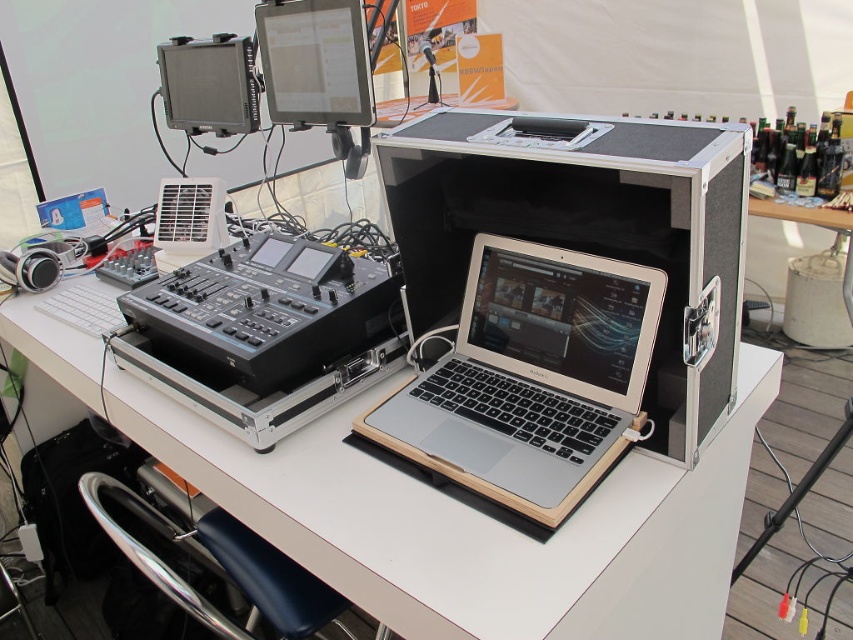
What object is located at the coordinates point (583, 225)?

The point (583, 225) is on silver black case at center.